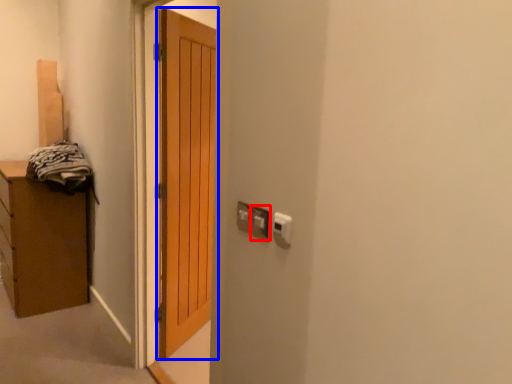
Question: Which object appears closest to the camera in this image, electric outlet (highlighted by a red box) or door (highlighted by a blue box)?

Choices:
 (A) electric outlet
 (B) door

Answer: (A)